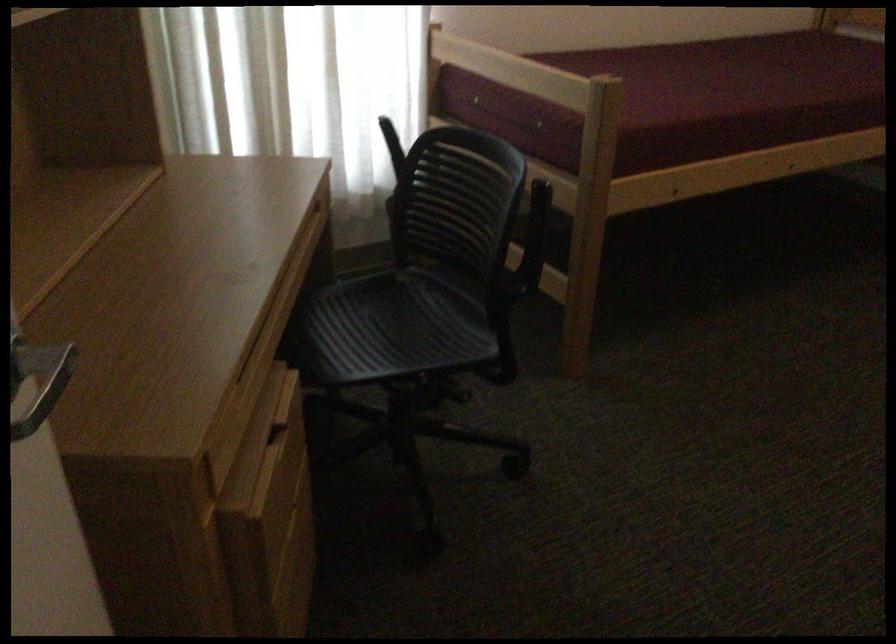
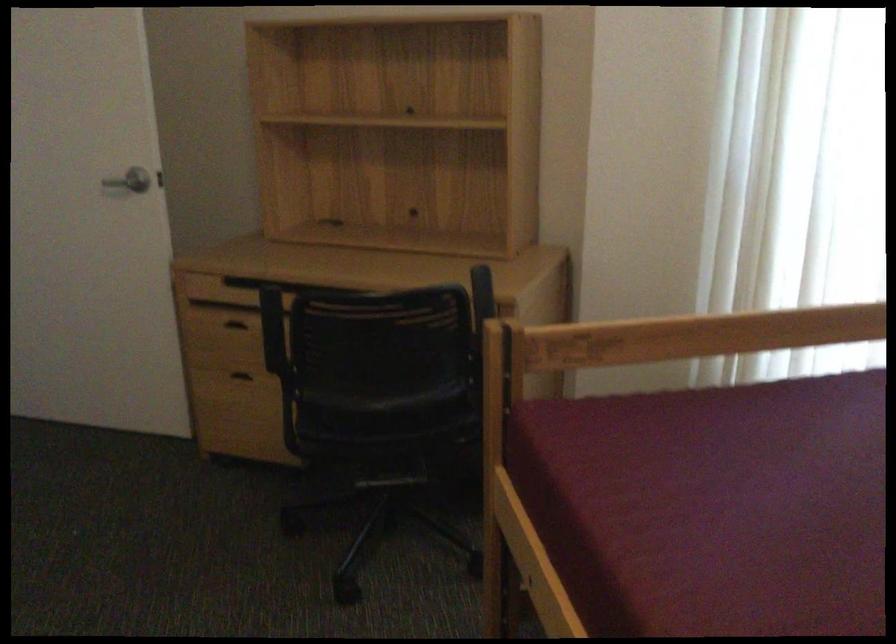
The point at (282, 542) is marked in the first image. Where is the corresponding point in the second image?

(246, 374)